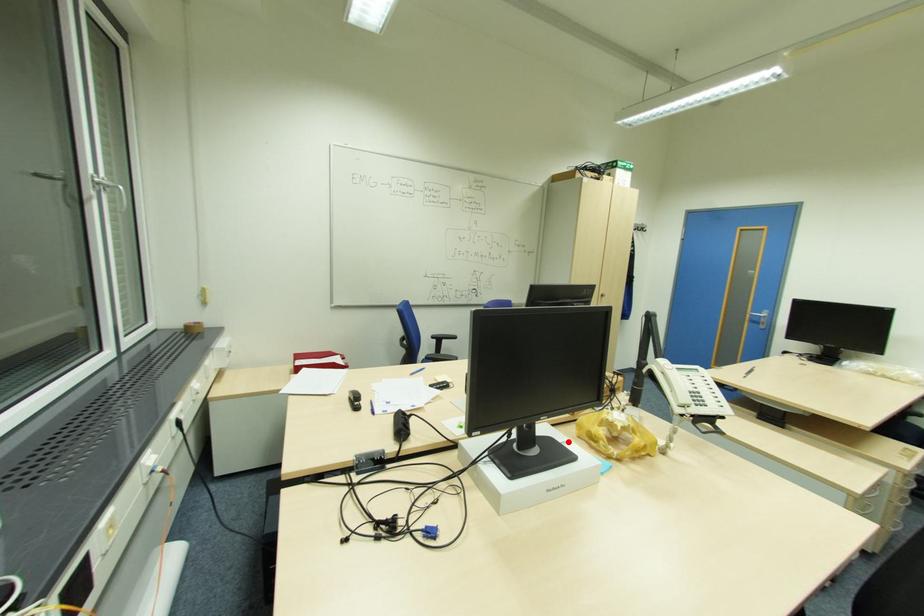
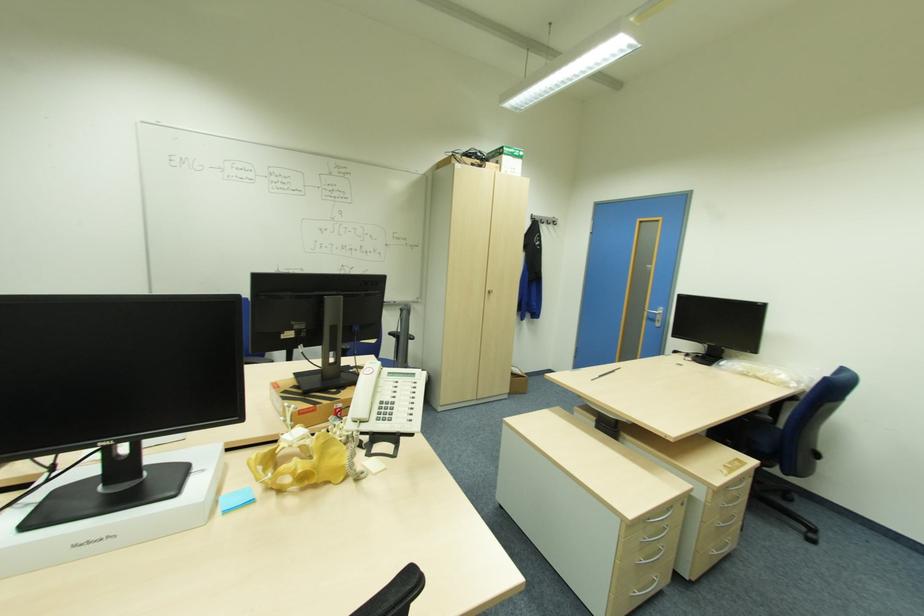
The point at the highlighted location is marked in the first image. Where is the corresponding point in the second image?

(207, 469)